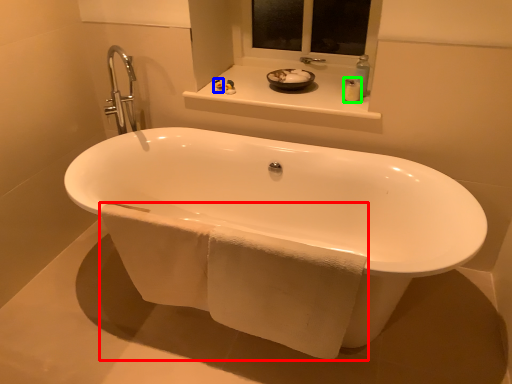
Question: Which object is the farthest from bath towel (highlighted by a red box)? Choose among these: toiletry (highlighted by a blue box) or toiletry (highlighted by a green box).

Choices:
 (A) toiletry
 (B) toiletry

Answer: (A)